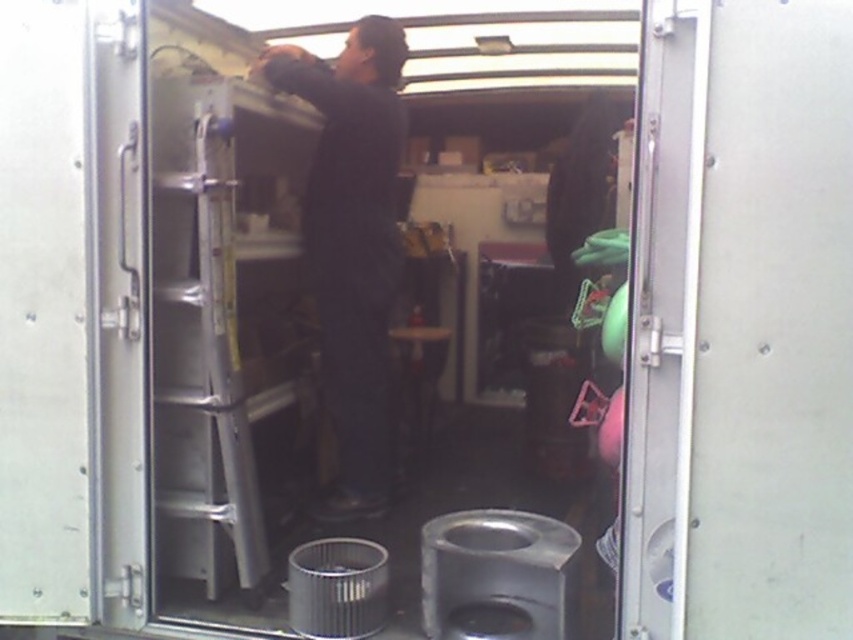
Can you confirm if silver metallic ladder at center is bigger than dark matte clothing at upper center?

No.

Describe the element at coordinates (200, 348) in the screenshot. The width and height of the screenshot is (853, 640). I see `silver metallic ladder at center` at that location.

Which is behind, point (154, 106) or point (375, 182)?

The point (375, 182) is more distant.

Locate an element on the screen. silver metallic ladder at center is located at coordinates (200, 348).

Is silver metallic ladder at center positioned behind metallic silver door at center?

Yes, silver metallic ladder at center is behind metallic silver door at center.

Between silver metallic ladder at center and metallic silver door at center, which one appears on the left side from the viewer's perspective?

silver metallic ladder at center

Who is more distant from viewer, (209, 182) or (688, 241)?

Positioned behind is point (209, 182).

You are a GUI agent. You are given a task and a screenshot of the screen. Output one action in this format:
    pyautogui.click(x=<x>, y=<y>)
    Task: Click on the silver metallic ladder at center
    The image size is (853, 640).
    Given the screenshot: What is the action you would take?
    pyautogui.click(x=200, y=348)

Who is taller, metallic silver door at center or dark matte clothing at upper center?

Standing taller between the two is dark matte clothing at upper center.

Between metallic silver door at center and dark matte clothing at upper center, which one is positioned lower?

metallic silver door at center is lower down.

You are a GUI agent. You are given a task and a screenshot of the screen. Output one action in this format:
    pyautogui.click(x=<x>, y=<y>)
    Task: Click on the metallic silver door at center
    Image resolution: width=853 pixels, height=640 pixels.
    Given the screenshot: What is the action you would take?
    pyautogui.click(x=662, y=317)